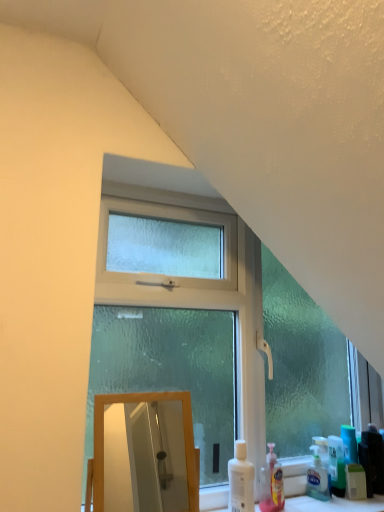
Question: From a real-world perspective, is wooden mirror at lower left on top of frosted glass window at center?

Choices:
 (A) no
 (B) yes

Answer: (A)

Question: Does wooden mirror at lower left have a lesser width compared to frosted glass window at center?

Choices:
 (A) yes
 (B) no

Answer: (A)

Question: Is wooden mirror at lower left aimed at frosted glass window at center?

Choices:
 (A) no
 (B) yes

Answer: (A)

Question: Is wooden mirror at lower left at the right side of frosted glass window at center?

Choices:
 (A) no
 (B) yes

Answer: (A)

Question: Is wooden mirror at lower left shorter than frosted glass window at center?

Choices:
 (A) yes
 (B) no

Answer: (A)

Question: In terms of size, does frosted glass window at center appear bigger or smaller than translucent plastic bottle at lower center, the 1th cleaning product in the right-to-left sequence?

Choices:
 (A) small
 (B) big

Answer: (B)

Question: Is frosted glass window at center inside the boundaries of translucent plastic bottle at lower center, the 1th cleaning product in the right-to-left sequence, or outside?

Choices:
 (A) outside
 (B) inside

Answer: (A)

Question: Does point (218, 364) appear closer or farther from the camera than point (259, 473)?

Choices:
 (A) closer
 (B) farther

Answer: (B)

Question: From the image's perspective, is frosted glass window at center above or below translucent plastic bottle at lower center, the 1th cleaning product in the right-to-left sequence?

Choices:
 (A) below
 (B) above

Answer: (B)

Question: From a real-world perspective, is frosted glass window at center positioned above or below wooden mirror at lower left?

Choices:
 (A) above
 (B) below

Answer: (A)

Question: In terms of size, does frosted glass window at center appear bigger or smaller than wooden mirror at lower left?

Choices:
 (A) small
 (B) big

Answer: (B)

Question: From the image's perspective, relative to wooden mirror at lower left, is frosted glass window at center above or below?

Choices:
 (A) above
 (B) below

Answer: (A)

Question: Considering the positions of frosted glass window at center and wooden mirror at lower left in the image, is frosted glass window at center taller or shorter than wooden mirror at lower left?

Choices:
 (A) short
 (B) tall

Answer: (B)

Question: Does point (246, 385) appear closer or farther from the camera than point (235, 444)?

Choices:
 (A) farther
 (B) closer

Answer: (B)

Question: Looking at their shapes, would you say frosted glass window at center is wider or thinner than white plastic bottle at lower right, the 2th cleaning product when ordered from right to left?

Choices:
 (A) wide
 (B) thin

Answer: (A)